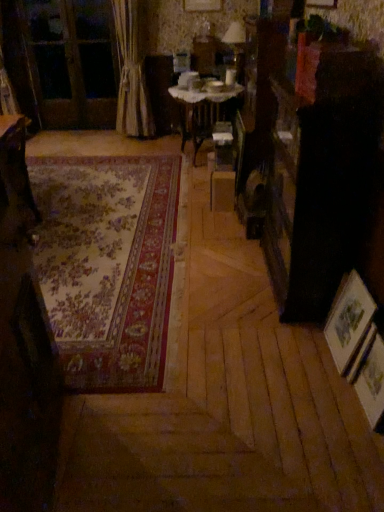
Question: Is wooden table at left, the first table viewed from the left, bigger or smaller than wooden picture frame at lower right, which is the first picture frame in front-to-back order?

Choices:
 (A) big
 (B) small

Answer: (A)

Question: Is point coord(21,145) positioned closer to the camera than point coord(372,401)?

Choices:
 (A) farther
 (B) closer

Answer: (B)

Question: Which of these objects is positioned closest to the wooden table at center, which is counted as the second table, starting from the front?

Choices:
 (A) floral carpet at center
 (B) beige fabric curtain at left
 (C) wooden screen door at upper left
 (D) matte glass table lamp at upper center
 (E) wooden picture frame at lower right, which is the first picture frame in front-to-back order

Answer: (D)

Question: Considering the real-world distances, which object is closest to the wooden table at left, acting as the 1th table starting from the bottom?

Choices:
 (A) floral carpet at center
 (B) wooden table at center, which is counted as the second table, starting from the front
 (C) wooden picture frame at lower right, the 2th picture frame from the front
 (D) beige fabric curtain at left
 (E) matte glass table lamp at upper center

Answer: (A)